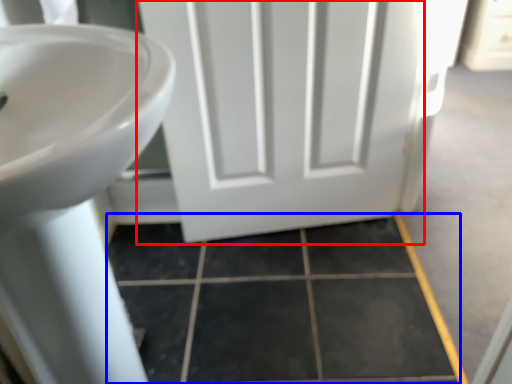
Question: Among these objects, which one is nearest to the camera, door (highlighted by a red box) or tile (highlighted by a blue box)?

Choices:
 (A) door
 (B) tile

Answer: (A)